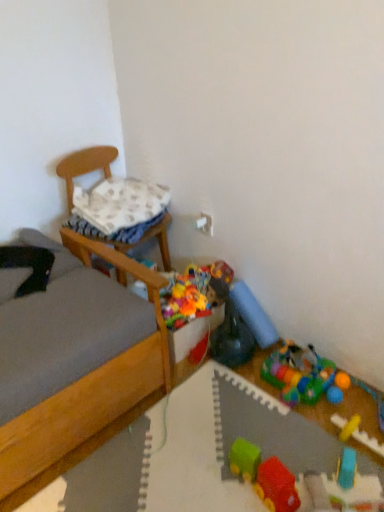
Question: Is rubberized plastic toy at lower right, the 6th toy when ordered from front to back, a part of blue rubber toy at lower right, which is the 3th toy from front to back?

Choices:
 (A) no
 (B) yes

Answer: (A)

Question: Can you confirm if blue rubber toy at lower right, which is the fourth toy in back-to-front order, is wider than rubberized plastic toy at lower right, placed as the first toy when sorted from back to front?

Choices:
 (A) no
 (B) yes

Answer: (A)

Question: Can you confirm if blue rubber toy at lower right, which is the fourth toy in back-to-front order, is positioned to the right of rubberized plastic toy at lower right, placed as the first toy when sorted from back to front?

Choices:
 (A) yes
 (B) no

Answer: (A)

Question: Can you confirm if blue rubber toy at lower right, which is the fourth toy in back-to-front order, is bigger than rubberized plastic toy at lower right, the 6th toy when ordered from front to back?

Choices:
 (A) no
 (B) yes

Answer: (A)

Question: Is blue rubber toy at lower right, which is the fourth toy in back-to-front order, at the left side of rubberized plastic toy at lower right, the 6th toy when ordered from front to back?

Choices:
 (A) yes
 (B) no

Answer: (B)

Question: Does blue rubber toy at lower right, which is the 3th toy from front to back, lie behind rubberized plastic toy at lower right, placed as the first toy when sorted from back to front?

Choices:
 (A) yes
 (B) no

Answer: (B)

Question: Considering the relative sizes of yellow rubber train at lower right, which is the 2th toy from front to back, and wooden chair at left in the image provided, is yellow rubber train at lower right, which is the 2th toy from front to back, wider than wooden chair at left?

Choices:
 (A) yes
 (B) no

Answer: (B)

Question: From the image's perspective, is yellow rubber train at lower right, placed as the fifth toy when sorted from back to front, on wooden chair at left?

Choices:
 (A) yes
 (B) no

Answer: (B)

Question: Considering the relative sizes of yellow rubber train at lower right, which is the 2th toy from front to back, and wooden chair at left in the image provided, is yellow rubber train at lower right, which is the 2th toy from front to back, taller than wooden chair at left?

Choices:
 (A) no
 (B) yes

Answer: (A)

Question: Does yellow rubber train at lower right, which is the 2th toy from front to back, appear on the right side of wooden chair at left?

Choices:
 (A) no
 (B) yes

Answer: (B)

Question: From a real-world perspective, is yellow rubber train at lower right, placed as the fifth toy when sorted from back to front, located beneath wooden chair at left?

Choices:
 (A) yes
 (B) no

Answer: (A)

Question: From a real-world perspective, does yellow rubber train at lower right, placed as the fifth toy when sorted from back to front, stand above wooden chair at left?

Choices:
 (A) yes
 (B) no

Answer: (B)

Question: Does white textured pillow at upper left have a greater height compared to rubberized plastic toy at lower right, placed as the first toy when sorted from back to front?

Choices:
 (A) yes
 (B) no

Answer: (B)